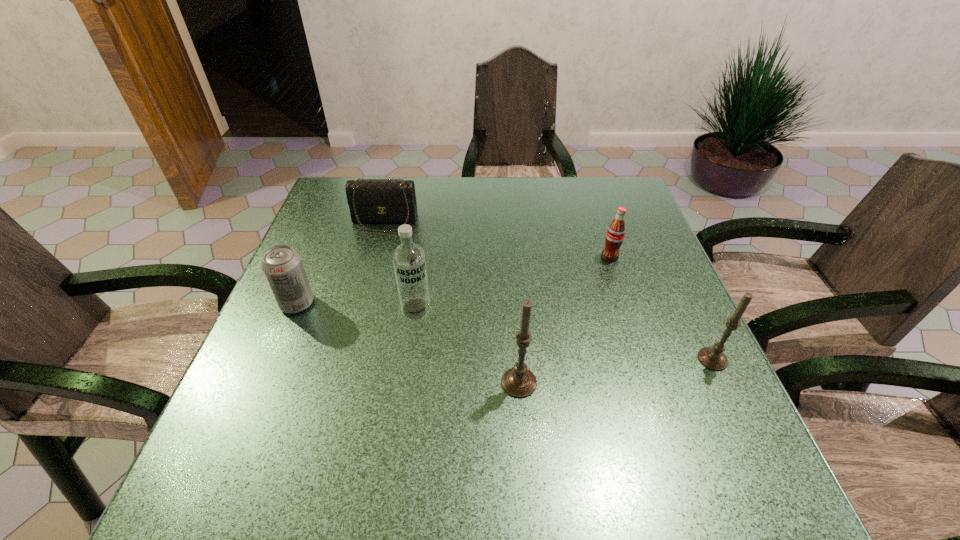
The width and height of the screenshot is (960, 540). In order to click on soda can that is positioned at the left edge in this screenshot , I will do `click(282, 266)`.

You are a GUI agent. You are given a task and a screenshot of the screen. Output one action in this format:
    pyautogui.click(x=<x>, y=<y>)
    Task: Click on the candle positioned at the right edge
    This screenshot has height=540, width=960.
    Given the screenshot: What is the action you would take?
    pyautogui.click(x=713, y=358)

Where is `soda that is at the right edge`? The image size is (960, 540). soda that is at the right edge is located at coordinates (615, 234).

Locate an element on the screen. object that is at the far left corner is located at coordinates (370, 200).

Where is `free space at the far edge`? free space at the far edge is located at coordinates (501, 217).

In order to click on vacant space at the near edge of the desktop in this screenshot , I will do `click(409, 396)`.

This screenshot has width=960, height=540. In the image, there is a desktop. Find the location of `blank space at the left edge`. blank space at the left edge is located at coordinates (347, 301).

In the image, there is a desktop. At what (x,y) coordinates should I click in order to perform the action: click on vacant space at the right edge. Please return your answer as a coordinate pair (x, y). This screenshot has height=540, width=960. Looking at the image, I should click on (664, 334).

The width and height of the screenshot is (960, 540). In order to click on free space between the third object from right to left and the shorter candle in this screenshot , I will do `click(616, 371)`.

What are the coordinates of `free space that is in between the third object from left to right and the fourth shortest object` in the screenshot? It's located at (564, 334).